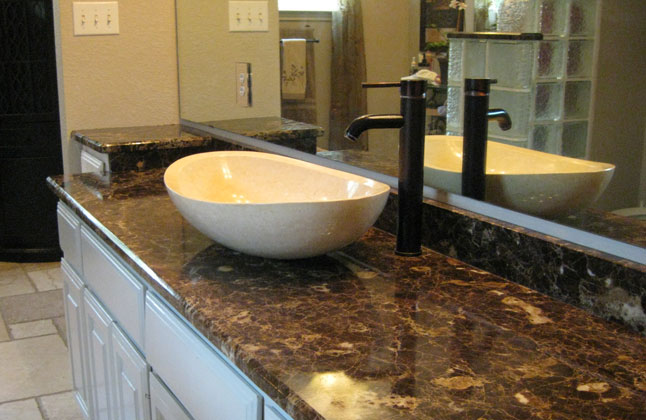
Where is `mirror`? mirror is located at coordinates (550, 149).